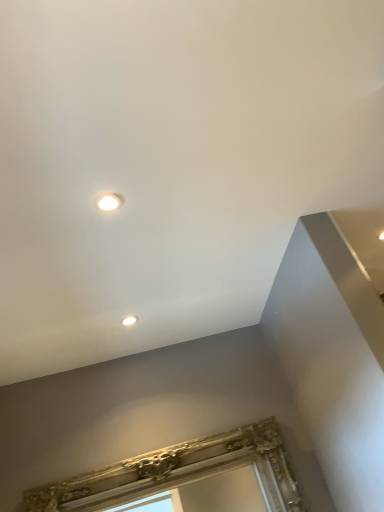
This screenshot has width=384, height=512. Identify the location of matte white droplight at upper center, the 2th droplight from the top. (129, 320).

Who is taller, matte white droplight at upper center, acting as the 1th droplight starting from the back, or gold ornate frame at lower center?

gold ornate frame at lower center.

Is matte white droplight at upper center, acting as the 1th droplight starting from the back, facing away from gold ornate frame at lower center?

No, matte white droplight at upper center, acting as the 1th droplight starting from the back, is not facing the opposite direction of gold ornate frame at lower center.

Consider the image. Considering the sizes of objects matte white droplight at upper center, which is the first droplight from bottom to top, and gold ornate frame at lower center in the image provided, who is thinner, matte white droplight at upper center, which is the first droplight from bottom to top, or gold ornate frame at lower center?

With smaller width is matte white droplight at upper center, which is the first droplight from bottom to top.

Considering the relative sizes of matte white droplight at upper center, which is the first droplight from top to bottom, and matte white droplight at upper center, which is the first droplight from bottom to top, in the image provided, is matte white droplight at upper center, which is the first droplight from top to bottom, shorter than matte white droplight at upper center, which is the first droplight from bottom to top,?

No, matte white droplight at upper center, which is the first droplight from top to bottom, is not shorter than matte white droplight at upper center, which is the first droplight from bottom to top.

From the picture: From a real-world perspective, which object rests below the other?

In real-world perspective, matte white droplight at upper center, which appears as the 2th droplight when viewed from the back, is lower.

This screenshot has width=384, height=512. What are the coordinates of `droplight above the matte white droplight at upper center, which is the first droplight from bottom to top (from the image's perspective)` in the screenshot? It's located at (109, 202).

Which is behind, point (132, 318) or point (110, 203)?

Point (132, 318)

Is matte white droplight at upper center, the second droplight from the front, turned away from matte white droplight at upper center, acting as the first droplight starting from the front?

No, matte white droplight at upper center, the second droplight from the front,'s orientation is not away from matte white droplight at upper center, acting as the first droplight starting from the front.

Is matte white droplight at upper center, which is the first droplight from bottom to top, in front of matte white droplight at upper center, which appears as the 2th droplight when viewed from the back?

No, matte white droplight at upper center, which is the first droplight from bottom to top, is further to the viewer.

From a real-world perspective, which object rests below the other?

In real-world perspective, gold ornate frame at lower center is lower.

Is gold ornate frame at lower center at the left side of matte white droplight at upper center, acting as the 1th droplight starting from the back?

Incorrect, gold ornate frame at lower center is not on the left side of matte white droplight at upper center, acting as the 1th droplight starting from the back.

Is matte white droplight at upper center, the second droplight from the front, a part of gold ornate frame at lower center?

No, gold ornate frame at lower center does not contain matte white droplight at upper center, the second droplight from the front.

Consider the image. From the image's perspective, which one is positioned lower, gold ornate frame at lower center or matte white droplight at upper center, which is the first droplight from bottom to top?

gold ornate frame at lower center appears lower in the image.

Can you tell me how much matte white droplight at upper center, acting as the first droplight starting from the front, and gold ornate frame at lower center differ in facing direction?

There is a 87.3-degree angle between the facing directions of matte white droplight at upper center, acting as the first droplight starting from the front, and gold ornate frame at lower center.

Which object is positioned more to the right, matte white droplight at upper center, which appears as the 2th droplight when viewed from the back, or gold ornate frame at lower center?

Positioned to the right is gold ornate frame at lower center.

Is matte white droplight at upper center, which is the first droplight from top to bottom, facing towards gold ornate frame at lower center?

No, matte white droplight at upper center, which is the first droplight from top to bottom, does not turn towards gold ornate frame at lower center.

From the image's perspective, relative to gold ornate frame at lower center, is matte white droplight at upper center, acting as the first droplight starting from the front, above or below?

matte white droplight at upper center, acting as the first droplight starting from the front, is situated higher than gold ornate frame at lower center in the image.

Between gold ornate frame at lower center and matte white droplight at upper center, which is the second droplight from bottom to top, which one has smaller size?

Smaller between the two is matte white droplight at upper center, which is the second droplight from bottom to top.

Where is `droplight that is the 1st one when counting leftward from the gold ornate frame at lower center`? The image size is (384, 512). droplight that is the 1st one when counting leftward from the gold ornate frame at lower center is located at coordinates (109, 202).

Between gold ornate frame at lower center and matte white droplight at upper center, which is the first droplight from top to bottom, which one has smaller width?

With smaller width is matte white droplight at upper center, which is the first droplight from top to bottom.

Considering the sizes of objects gold ornate frame at lower center and matte white droplight at upper center, which appears as the 2th droplight when viewed from the back, in the image provided, who is shorter, gold ornate frame at lower center or matte white droplight at upper center, which appears as the 2th droplight when viewed from the back,?

With less height is matte white droplight at upper center, which appears as the 2th droplight when viewed from the back.

This screenshot has width=384, height=512. What are the coordinates of `window frame that is under the matte white droplight at upper center, the second droplight from the front (from a real-world perspective)` in the screenshot? It's located at (179, 473).

This screenshot has height=512, width=384. Identify the location of droplight below the matte white droplight at upper center, which appears as the 2th droplight when viewed from the back (from the image's perspective). (129, 320).

From the image, which object appears to be nearer to matte white droplight at upper center, the 2th droplight from the top, matte white droplight at upper center, which is the second droplight from bottom to top, or gold ornate frame at lower center?

Based on the image, gold ornate frame at lower center appears to be nearer to matte white droplight at upper center, the 2th droplight from the top.

When comparing their distances from gold ornate frame at lower center, does matte white droplight at upper center, the 2th droplight from the top, or matte white droplight at upper center, which appears as the 2th droplight when viewed from the back, seem closer?

Among the two, matte white droplight at upper center, the 2th droplight from the top, is located nearer to gold ornate frame at lower center.

Which object lies further to the anchor point matte white droplight at upper center, which appears as the 2th droplight when viewed from the back, gold ornate frame at lower center or matte white droplight at upper center, acting as the 1th droplight starting from the back?

gold ornate frame at lower center is further to matte white droplight at upper center, which appears as the 2th droplight when viewed from the back.

Estimate the real-world distances between objects in this image. Which object is further from matte white droplight at upper center, which is the second droplight from bottom to top, matte white droplight at upper center, which is the first droplight from bottom to top, or gold ornate frame at lower center?

gold ornate frame at lower center is positioned further to the anchor matte white droplight at upper center, which is the second droplight from bottom to top.

Looking at the image, which one is located further to gold ornate frame at lower center, matte white droplight at upper center, which is the second droplight from bottom to top, or matte white droplight at upper center, acting as the 1th droplight starting from the back?

Among the two, matte white droplight at upper center, which is the second droplight from bottom to top, is located further to gold ornate frame at lower center.

Estimate the real-world distances between objects in this image. Which object is further from matte white droplight at upper center, which is the first droplight from bottom to top, gold ornate frame at lower center or matte white droplight at upper center, acting as the first droplight starting from the front?

Among the two, matte white droplight at upper center, acting as the first droplight starting from the front, is located further to matte white droplight at upper center, which is the first droplight from bottom to top.

Find the location of a particular element. The width and height of the screenshot is (384, 512). droplight between matte white droplight at upper center, which is the second droplight from bottom to top, and gold ornate frame at lower center from top to bottom is located at coordinates (129, 320).